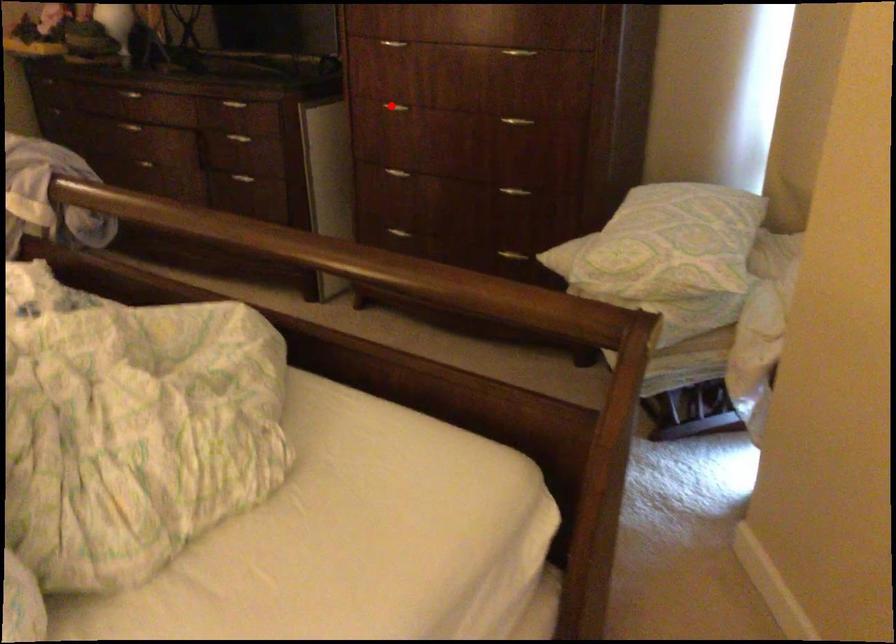
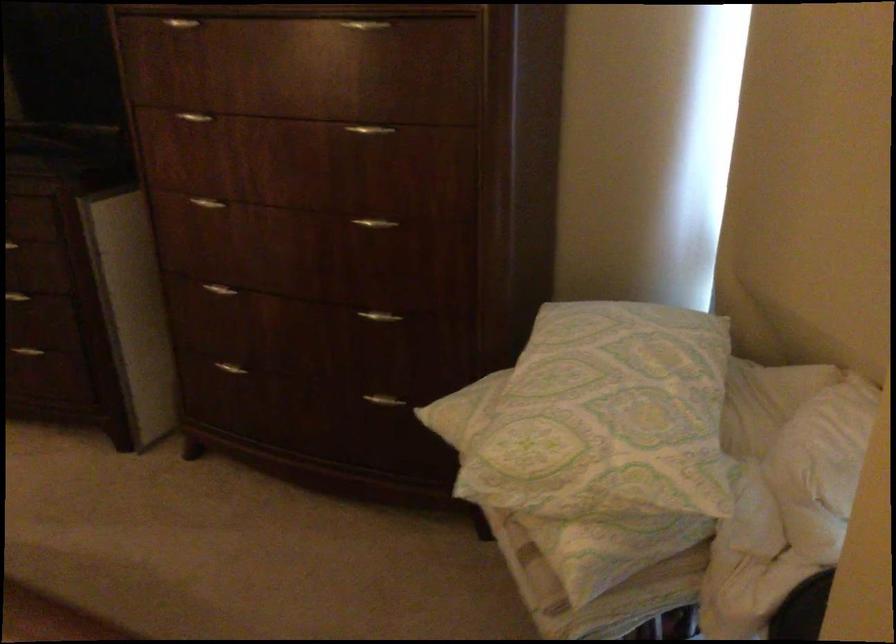
Question: I am providing you with two images of the same scene from different viewpoints. A red point is shown in image1. For the corresponding object point in image2, is it positioned nearer or farther from the camera?

Choices:
 (A) Nearer
 (B) Farther

Answer: (A)